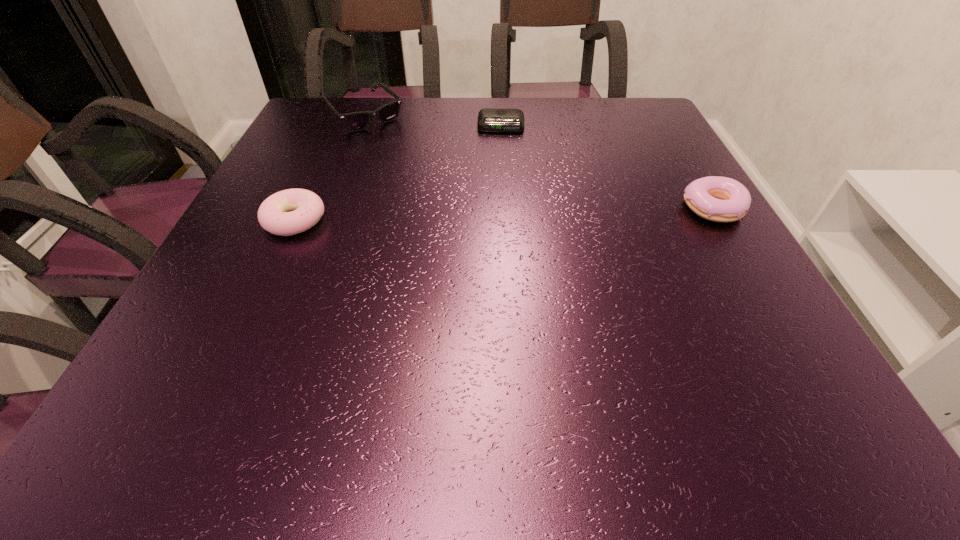
Identify the location of vacant space that satisfies the following two spatial constraints: 1. on the front side of the right doughnut; 2. on the right side of the shortest object. The height and width of the screenshot is (540, 960). (507, 208).